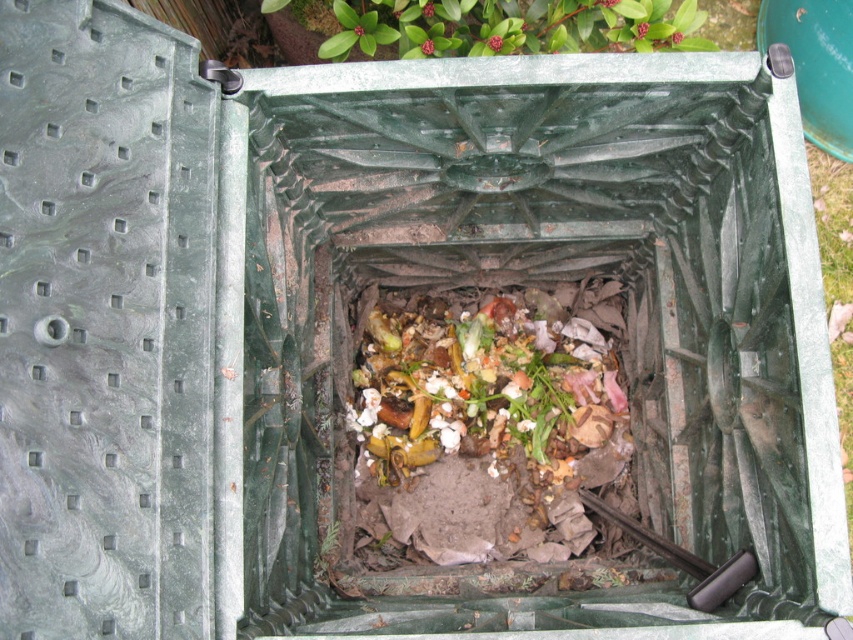
Question: From the image, what is the correct spatial relationship of brown crumbly food at center in relation to green leafy plant at upper center?

Choices:
 (A) above
 (B) below

Answer: (B)

Question: Does brown crumbly food at center have a smaller size compared to green leafy plant at upper center?

Choices:
 (A) no
 (B) yes

Answer: (B)

Question: Can you confirm if brown crumbly food at center is positioned to the left of green leafy plant at upper center?

Choices:
 (A) no
 (B) yes

Answer: (A)

Question: Which point appears farthest from the camera in this image?

Choices:
 (A) (534, 52)
 (B) (550, 406)

Answer: (B)